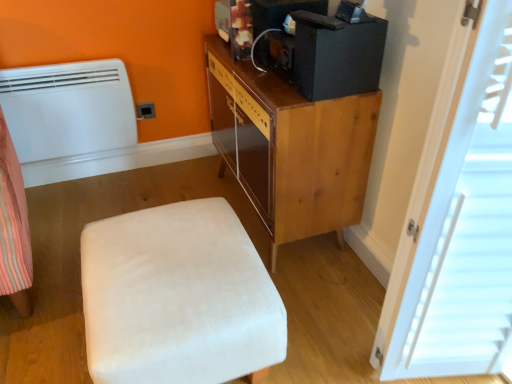
Question: Is black matte desktop computer at upper right bigger or smaller than matte plastic outlet at lower left?

Choices:
 (A) big
 (B) small

Answer: (A)

Question: Based on their positions, is black matte desktop computer at upper right located to the left or right of matte plastic outlet at lower left?

Choices:
 (A) right
 (B) left

Answer: (A)

Question: Which of these objects is positioned closest to the black matte desktop computer at upper right?

Choices:
 (A) white wood door at right
 (B) white matte heater at left
 (C) white velvety ottoman at lower left
 (D) matte plastic outlet at lower left
 (E) wooden cabinet at upper right

Answer: (E)

Question: Considering the real-world distances, which object is farthest from the white matte heater at left?

Choices:
 (A) white wood door at right
 (B) black matte desktop computer at upper right
 (C) black matte speaker at upper center
 (D) white velvety ottoman at lower left
 (E) matte plastic outlet at lower left

Answer: (A)